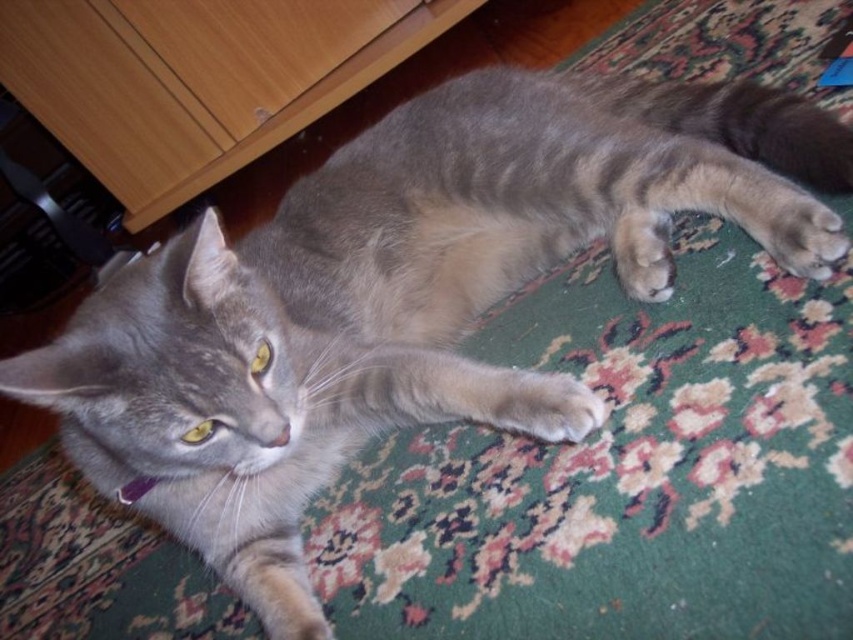
You are a cat owner observing your cat lying on a rug. You notice two gray fur paws. Which paw is wider, the gray fur paw at center or the gray fur paw at lower right?

The gray fur paw at center might be wider than the gray fur paw at lower right according to the description.

You are a cat owner who wants to place a small toy between the wooden dresser at upper left and the gray fur paw at lower right. Can you estimate if the space between them is wide enough for the toy which is 20 cm in length?

The wooden dresser at upper left is wider than the gray fur paw at lower right, but the exact distance between them isn not provided. Without knowing the actual space, it is impossible to determine if the toy will fit.

You are standing in front of the cat and want to take a photo. The camera you are using has a focus range of 1.0 meters to 1.2 meters. Is the point at coordinates point (575,384) within the camera focus range?

The point point (575,384) is 1.11 meters away from the camera, which falls within the focus range of 1.0 meters to 1.2 meters. Therefore, the point is within the camera focus range.